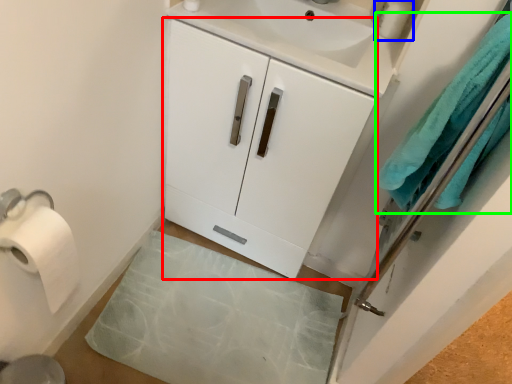
Question: Estimate the real-world distances between objects in this image. Which object is closer to cabinetry (highlighted by a red box), toiletry (highlighted by a blue box) or bath towel (highlighted by a green box)?

Choices:
 (A) toiletry
 (B) bath towel

Answer: (B)